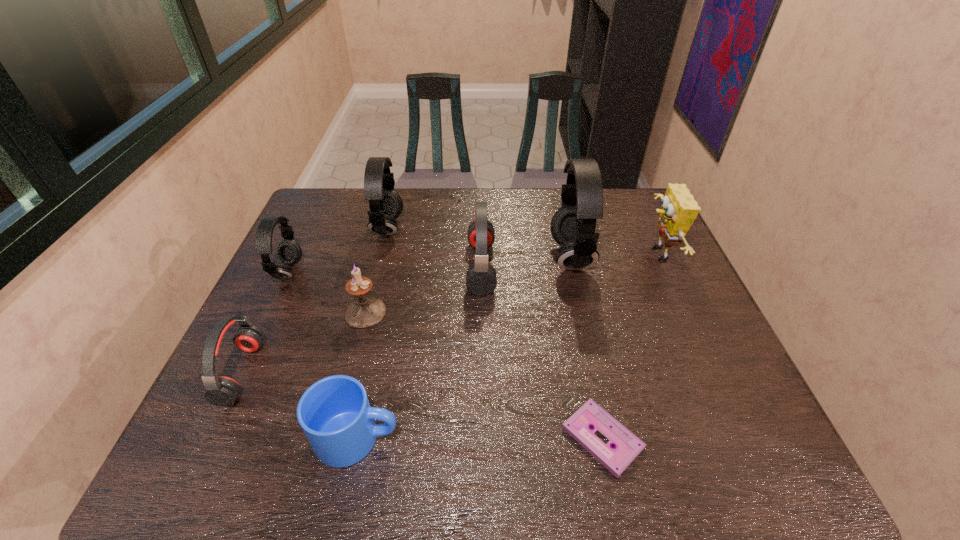
This screenshot has height=540, width=960. I want to click on blank region between the shortest object and the tallest object, so click(x=587, y=347).

The width and height of the screenshot is (960, 540). Identify the location of the sixth closest object to the tallest earphone. (334, 413).

Find the location of `the sixth closest object to the videotape`. the sixth closest object to the videotape is located at coordinates (386, 205).

Identify the location of earphone that stands as the second closest to the leftmost black earphone. (386, 205).

Identify which earphone is the fourth closest to the second shortest object. Please provide its 2D coordinates. Your answer should be formatted as a tuple, i.e. [(x, y)], where the tuple contains the x and y coordinates of a point satisfying the conditions above.

[(573, 225)]

Identify which black earphone is the nearest to the eighth tallest object. Please provide its 2D coordinates. Your answer should be formatted as a tuple, i.e. [(x, y)], where the tuple contains the x and y coordinates of a point satisfying the conditions above.

[(289, 252)]

Point out which black earphone is positioned as the second nearest to the second shortest object. Please provide its 2D coordinates. Your answer should be formatted as a tuple, i.e. [(x, y)], where the tuple contains the x and y coordinates of a point satisfying the conditions above.

[(573, 225)]

Where is `vacant region that satisfies the following two spatial constraints: 1. on the ear cups of the third earphone from left to right; 2. on the right side of the shortest object`? Image resolution: width=960 pixels, height=540 pixels. vacant region that satisfies the following two spatial constraints: 1. on the ear cups of the third earphone from left to right; 2. on the right side of the shortest object is located at coordinates (335, 438).